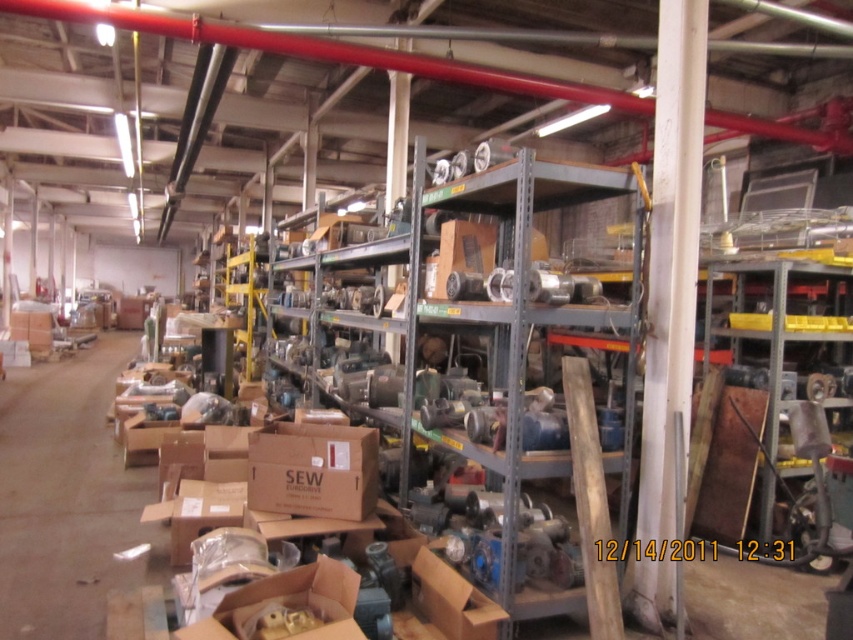
Question: Which point is closer to the camera?

Choices:
 (A) (280, 428)
 (B) (514, 486)
 (C) (662, 282)

Answer: (B)

Question: Is metallic gray shelf at center to the right of brown cardboard box at center from the viewer's perspective?

Choices:
 (A) no
 (B) yes

Answer: (B)

Question: Is metallic gray shelf at center above brown cardboard box at center?

Choices:
 (A) no
 (B) yes

Answer: (B)

Question: Among these objects, which one is farthest from the camera?

Choices:
 (A) brown cardboard box at center
 (B) white painted wood at right
 (C) metallic gray shelf at center

Answer: (A)

Question: Is the position of white painted wood at right more distant than that of brown cardboard box at center?

Choices:
 (A) no
 (B) yes

Answer: (A)

Question: Among these objects, which one is farthest from the camera?

Choices:
 (A) metallic gray shelf at center
 (B) brown cardboard box at center

Answer: (B)